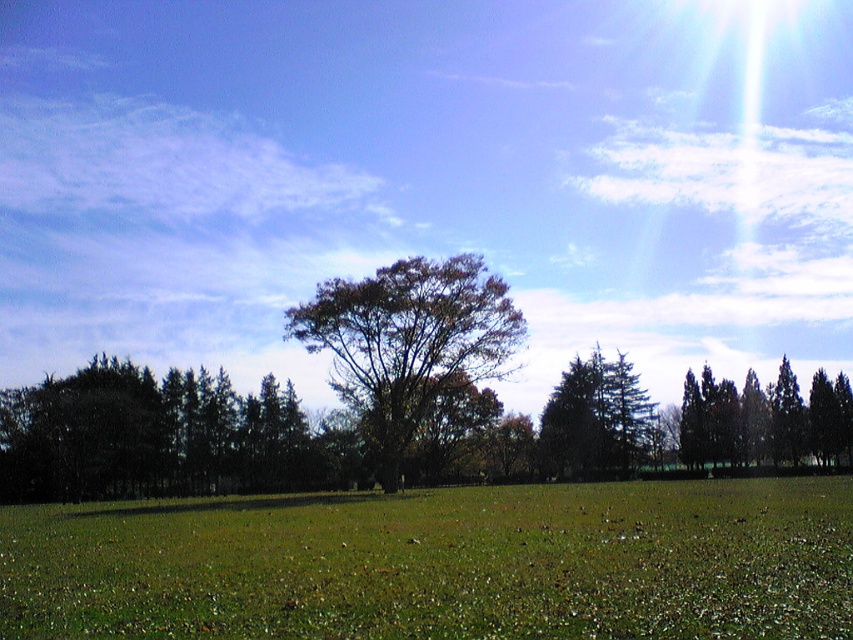
You are standing in the middle of the field in the image. You see a point marked at coordinates [149,436]. Which object does this point correspond to?

The point at coordinates [149,436] corresponds to the dark green leafy tree at left.

You are standing in the middle of the field and want to walk towards the dark green leafy tree at left and the green leafy tree at center. Which tree will you see first as you walk forward?

The dark green leafy tree at left will be seen first because it is positioned below the green leafy tree at center, meaning it is closer to the observer.